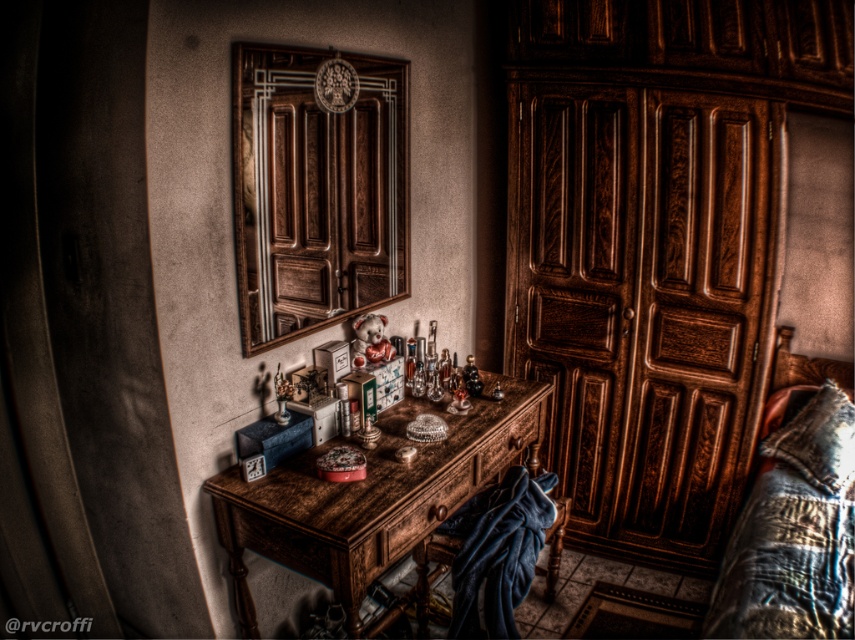
Does wooden dresser at center lie in front of wooden armoire at center?

No, it is not.

Which is behind, point (747, 394) or point (397, 236)?

The point (747, 394) is more distant.

In order to click on wooden dresser at center in this screenshot , I will do `click(655, 244)`.

Is wooden dresser at center above rustic wood table at center?

Yes, wooden dresser at center is above rustic wood table at center.

Is wooden dresser at center below rustic wood table at center?

Actually, wooden dresser at center is above rustic wood table at center.

Image resolution: width=855 pixels, height=640 pixels. Identify the location of wooden dresser at center. (655, 244).

Between wooden armoire at center and rustic wood table at center, which one appears on the right side from the viewer's perspective?

rustic wood table at center

Who is more forward, [293,221] or [370,552]?

Point [370,552]

Where is `wooden armoire at center`? wooden armoire at center is located at coordinates (317, 188).